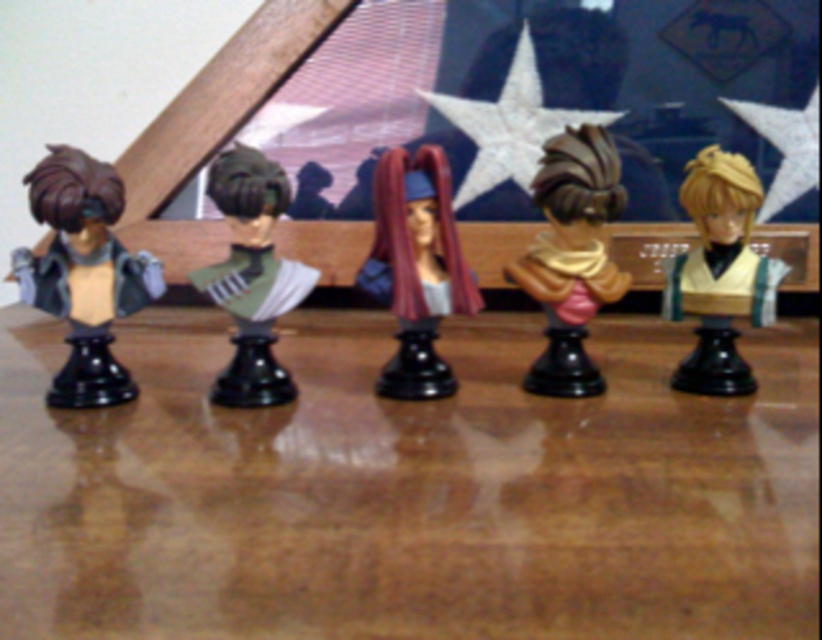
Is shiny gold bust at right thinner than matte green bust at center?

Yes.

Does shiny gold bust at right appear on the left side of matte green bust at center?

Incorrect, shiny gold bust at right is not on the left side of matte green bust at center.

Is point (700, 387) positioned before point (229, 196)?

No, it is behind (229, 196).

Locate an element on the screen. This screenshot has width=822, height=640. shiny gold bust at right is located at coordinates (719, 273).

Does brown polished wood table at center lie in front of satin burgundy hair at center?

Yes, it is in front of satin burgundy hair at center.

Who is more forward, [520,524] or [398,324]?

Positioned in front is point [520,524].

Locate an element on the screen. This screenshot has width=822, height=640. brown polished wood table at center is located at coordinates (409, 488).

Is matte brown bust at center taller than satin burgundy hair at center?

Correct, matte brown bust at center is much taller as satin burgundy hair at center.

Does point (557, 236) lie behind point (386, 221)?

That is True.

Which is behind, point (543, 243) or point (432, 305)?

The point (543, 243) is more distant.

At what (x,y) coordinates should I click in order to perform the action: click on matte brown bust at center. Please return your answer as a coordinate pair (x, y). Looking at the image, I should click on (571, 256).